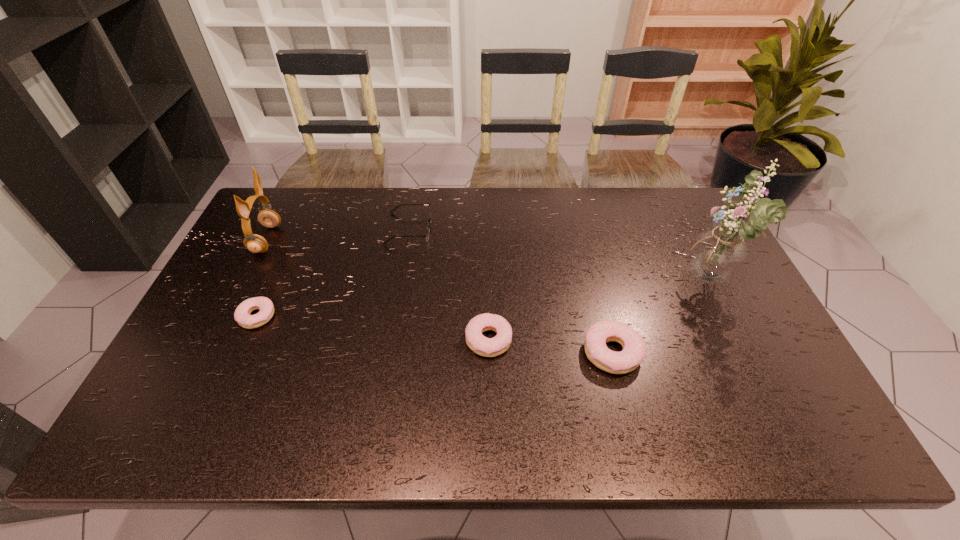
Where is `object that is at the near edge`? This screenshot has width=960, height=540. object that is at the near edge is located at coordinates (634, 348).

I want to click on doughnut that is positioned at the left edge, so click(242, 315).

You are a GUI agent. You are given a task and a screenshot of the screen. Output one action in this format:
    pyautogui.click(x=<x>, y=<y>)
    Task: Click on the earphone that is at the left edge
    This screenshot has height=540, width=960.
    Given the screenshot: What is the action you would take?
    pyautogui.click(x=254, y=243)

Identify the location of object present at the right edge. (717, 254).

Identify the location of object positioned at the far left corner. This screenshot has height=540, width=960. (254, 243).

Image resolution: width=960 pixels, height=540 pixels. Identify the location of vacant space at the far edge of the desktop. (468, 229).

I want to click on free space at the near edge, so (696, 377).

In the image, there is a desktop. Where is `free space at the left edge`? free space at the left edge is located at coordinates (218, 321).

At what (x,y) coordinates should I click in order to perform the action: click on free space at the right edge of the desktop. Please return your answer as a coordinate pair (x, y). This screenshot has height=540, width=960. Looking at the image, I should click on (731, 295).

At what (x,y) coordinates should I click in order to perform the action: click on vacant space at the far left corner. Please return your answer as a coordinate pair (x, y). This screenshot has width=960, height=540. Looking at the image, I should click on (266, 229).